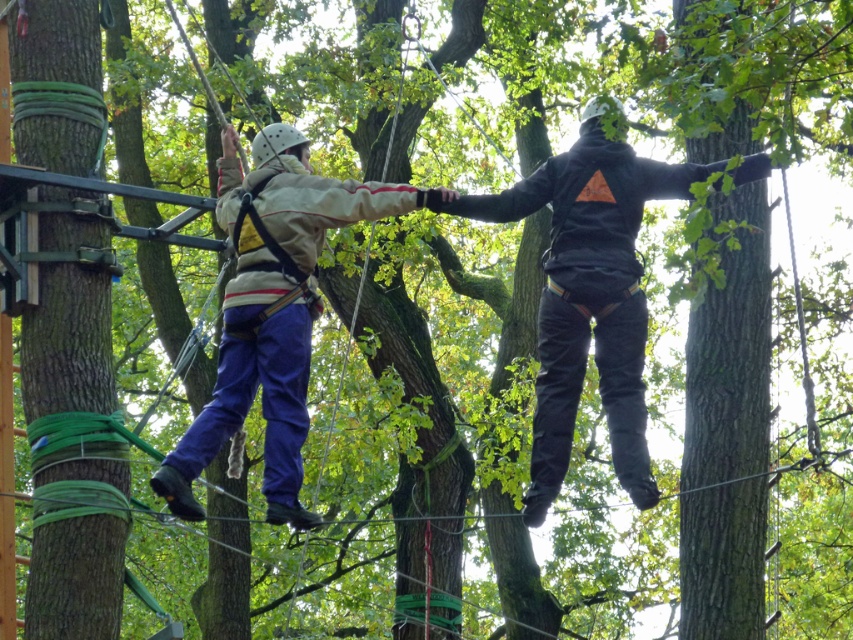
You are a safety inspector checking the ropes course setup. You notice two participants wearing the black matte hoodie at center and the matte beige jacket at center. According to safety regulations, the width of the harness must match the participant clothing width. Which participant might need to adjust their harness?

The black matte hoodie at center has a larger width than the matte beige jacket at center, so the participant wearing the black matte hoodie at center may need to adjust their harness to ensure it matches the correct width.

You are navigating a ropes course in the forest and need to move from the starting platform to the next platform. You see two points marked in your path. The first point is at coordinate point(706, 168) and the second point is at coordinate point(227, 177). Which point should you aim for first to follow the correct path?

You should aim for point(706, 168) first because it is positioned in front of point(227, 177) along your path.